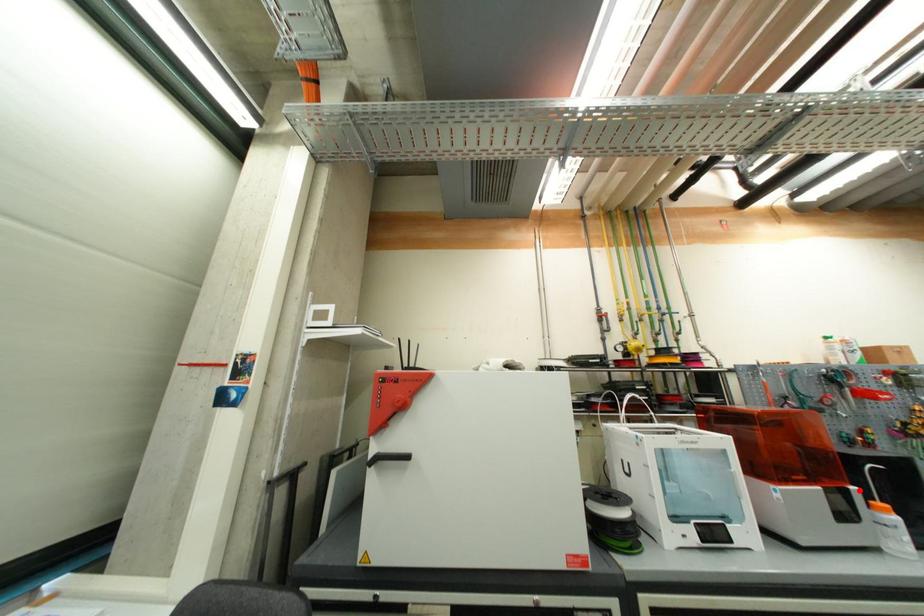
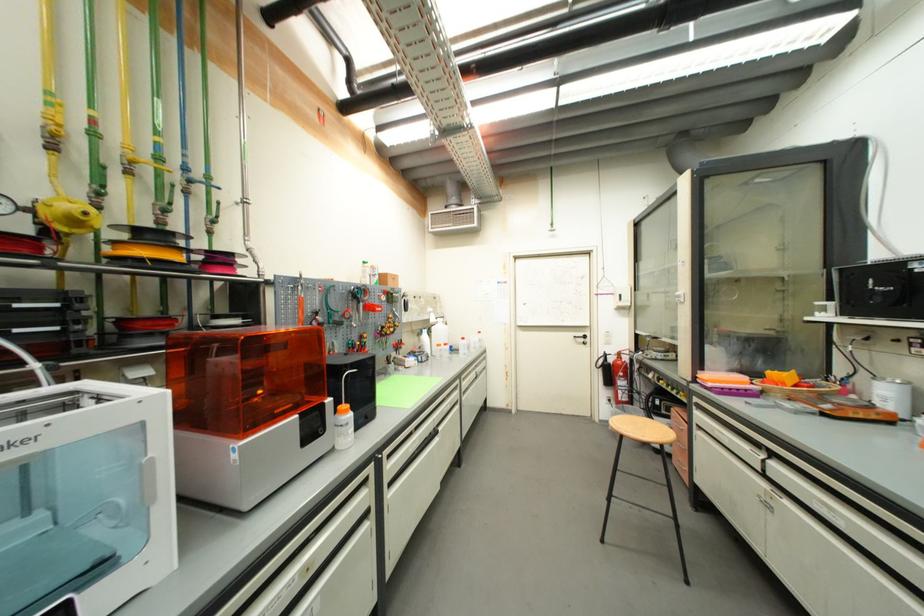
Find the pixel in the second image that matches the highlighted location in the first image.

(334, 402)